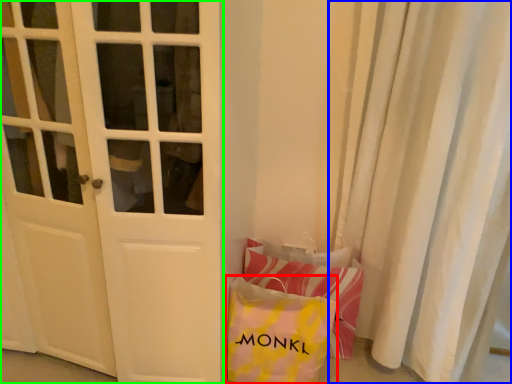
Question: Which object is positioned farthest from pouch (highlighted by a red box)? Select from curtain (highlighted by a blue box) and door (highlighted by a green box).

Choices:
 (A) curtain
 (B) door

Answer: (A)